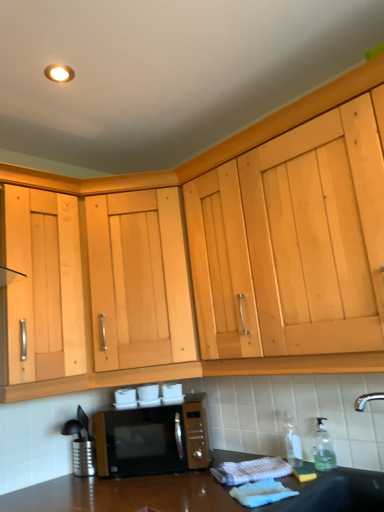
Question: Is the position of clear glass bottle at lower right, the second bottle viewed from the right, more distant than that of black matte sink at lower right?

Choices:
 (A) yes
 (B) no

Answer: (A)

Question: Is clear glass bottle at lower right, the 1th bottle positioned from the left, positioned with its back to black matte sink at lower right?

Choices:
 (A) no
 (B) yes

Answer: (A)

Question: Can you confirm if clear glass bottle at lower right, the second bottle viewed from the right, is smaller than black matte sink at lower right?

Choices:
 (A) no
 (B) yes

Answer: (B)

Question: Does clear glass bottle at lower right, the 1th bottle positioned from the left, come in front of black matte sink at lower right?

Choices:
 (A) yes
 (B) no

Answer: (B)

Question: Could you tell me if clear glass bottle at lower right, the second bottle viewed from the right, is facing black matte sink at lower right?

Choices:
 (A) no
 (B) yes

Answer: (A)

Question: Is point (291, 420) closer or farther from the camera than point (326, 465)?

Choices:
 (A) farther
 (B) closer

Answer: (A)

Question: Do you think clear glass bottle at lower right, the 1th bottle positioned from the left, is within transparent plastic soap dispenser at lower right, acting as the 2th bottle starting from the left, or outside of it?

Choices:
 (A) inside
 (B) outside

Answer: (B)

Question: From the image's perspective, relative to transparent plastic soap dispenser at lower right, the first bottle when ordered from right to left, is clear glass bottle at lower right, the second bottle viewed from the right, above or below?

Choices:
 (A) above
 (B) below

Answer: (B)

Question: Is clear glass bottle at lower right, the 1th bottle positioned from the left, wider or thinner than transparent plastic soap dispenser at lower right, acting as the 2th bottle starting from the left?

Choices:
 (A) thin
 (B) wide

Answer: (B)

Question: Considering the relative positions of transparent plastic soap dispenser at lower right, the first bottle when ordered from right to left, and black matte sink at lower right in the image provided, is transparent plastic soap dispenser at lower right, the first bottle when ordered from right to left, to the left or to the right of black matte sink at lower right?

Choices:
 (A) right
 (B) left

Answer: (A)

Question: In terms of height, does transparent plastic soap dispenser at lower right, the first bottle when ordered from right to left, look taller or shorter compared to black matte sink at lower right?

Choices:
 (A) short
 (B) tall

Answer: (A)

Question: Which is correct: transparent plastic soap dispenser at lower right, acting as the 2th bottle starting from the left, is inside black matte sink at lower right, or outside of it?

Choices:
 (A) outside
 (B) inside

Answer: (A)

Question: From a real-world perspective, is transparent plastic soap dispenser at lower right, the first bottle when ordered from right to left, physically located above or below black matte sink at lower right?

Choices:
 (A) below
 (B) above

Answer: (B)

Question: From a real-world perspective, is transparent plastic soap dispenser at lower right, the first bottle when ordered from right to left, above or below clear glass bottle at lower right, the 1th bottle positioned from the left?

Choices:
 (A) below
 (B) above

Answer: (A)

Question: Is transparent plastic soap dispenser at lower right, acting as the 2th bottle starting from the left, taller or shorter than clear glass bottle at lower right, the second bottle viewed from the right?

Choices:
 (A) short
 (B) tall

Answer: (A)